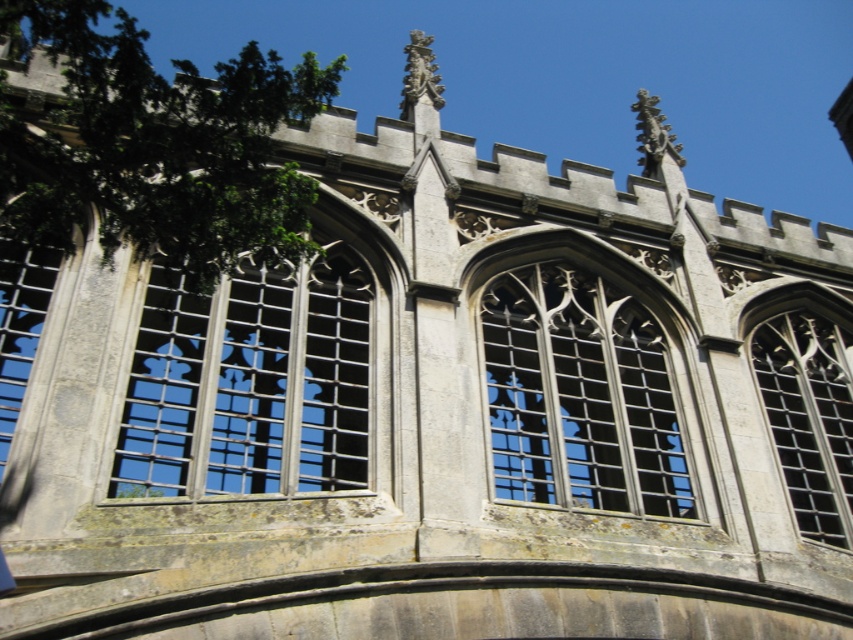
Question: Among these objects, which one is farthest from the camera?

Choices:
 (A) matte stone window at center
 (B) clear glass window at center

Answer: (A)

Question: Which object is the farthest from the clear stone window at upper right?

Choices:
 (A) clear glass window at center
 (B) matte stone window at center
 (C) green leafy tree at upper left

Answer: (C)

Question: Estimate the real-world distances between objects in this image. Which object is closer to the clear stone window at upper right?

Choices:
 (A) clear glass window at center
 (B) green leafy tree at upper left
 (C) matte stone window at center

Answer: (C)

Question: Can you confirm if green leafy tree at upper left is thinner than matte stone window at center?

Choices:
 (A) yes
 (B) no

Answer: (B)

Question: Can you confirm if green leafy tree at upper left is smaller than clear glass window at center?

Choices:
 (A) no
 (B) yes

Answer: (A)

Question: Does clear glass window at center have a lesser width compared to clear stone window at upper right?

Choices:
 (A) yes
 (B) no

Answer: (B)